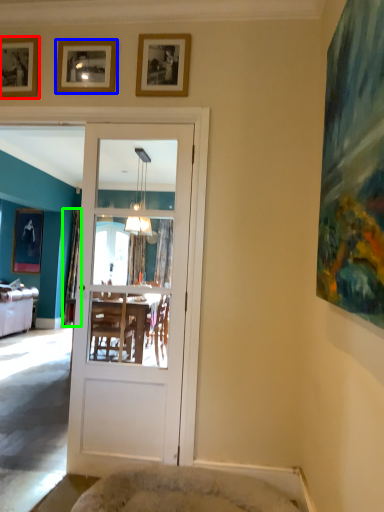
Question: Considering the real-world distances, which object is farthest from picture frame (highlighted by a red box)? picture frame (highlighted by a blue box) or curtain (highlighted by a green box)?

Choices:
 (A) picture frame
 (B) curtain

Answer: (B)